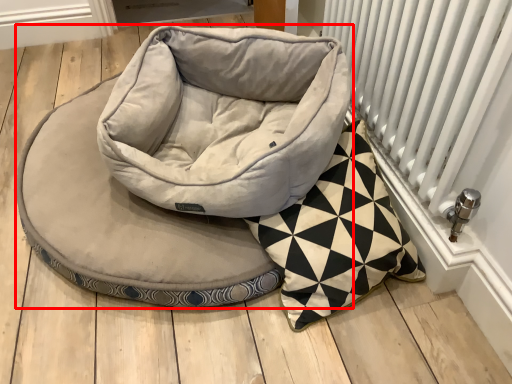
Question: From the image's perspective, considering the relative positions of dog bed (annotated by the red box) and radiator in the image provided, where is dog bed (annotated by the red box) located with respect to the staircase?

Choices:
 (A) above
 (B) below

Answer: (B)